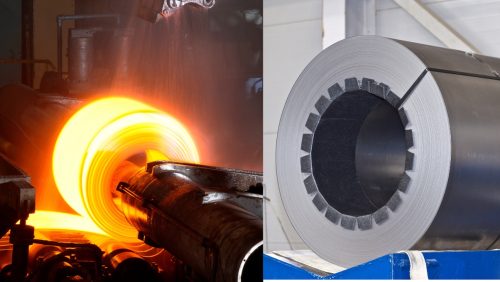
Find the location of `table`. table is located at coordinates (317, 260).